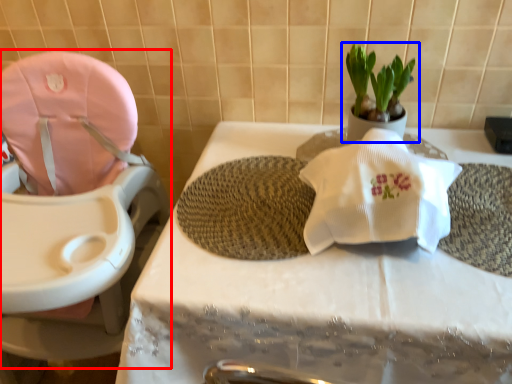
Question: Which object is closer to the camera taking this photo, baby carriage (highlighted by a red box) or houseplant (highlighted by a blue box)?

Choices:
 (A) baby carriage
 (B) houseplant

Answer: (A)